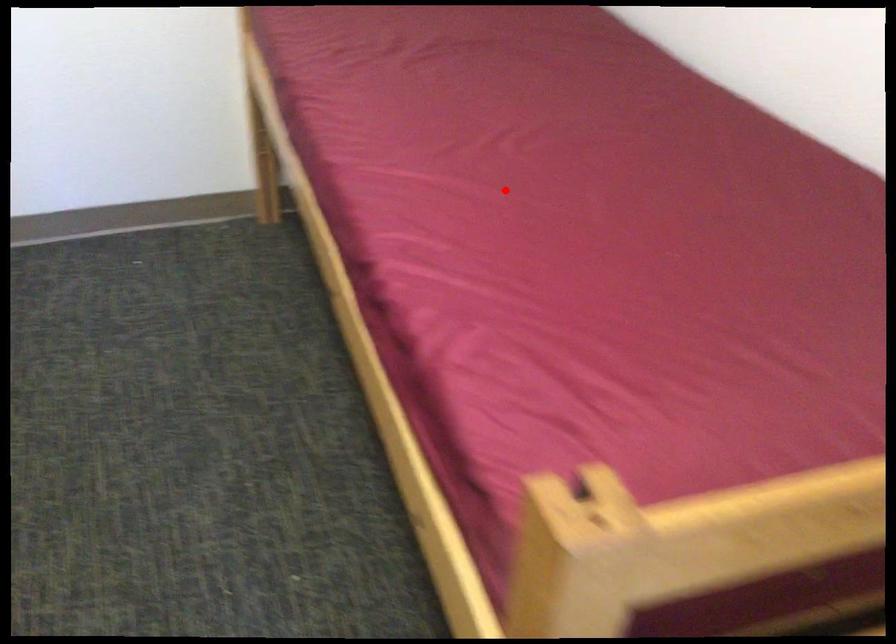
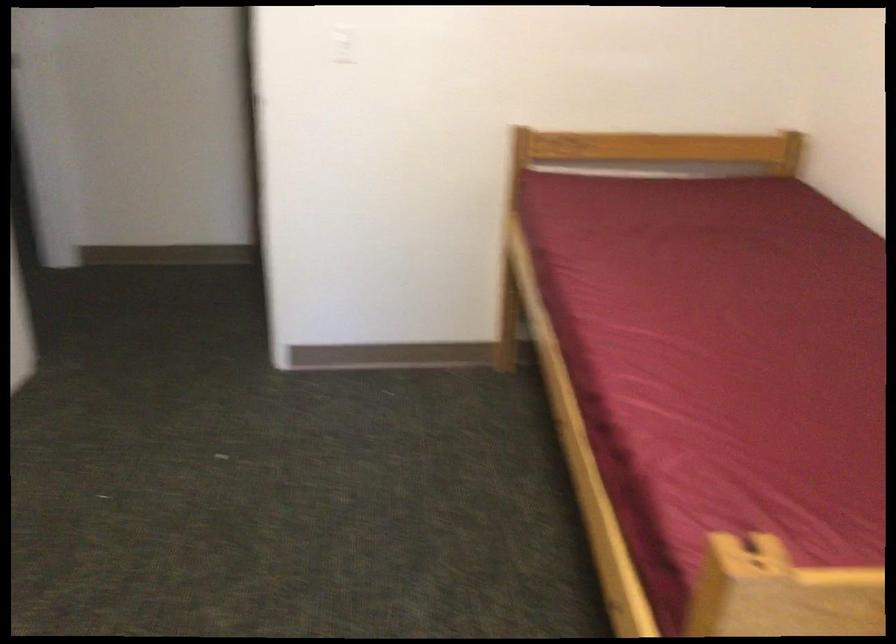
Question: A red point is marked in image1. In image2, is the corresponding 3D point closer to the camera or farther? Reply with the corresponding letter.

Choices:
 (A) The corresponding 3D point is closer.
 (B) The corresponding 3D point is farther.

Answer: (B)